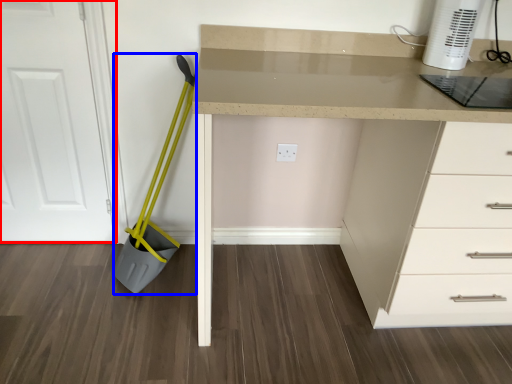
Question: Which object is further to the camera taking this photo, door (highlighted by a red box) or shovel (highlighted by a blue box)?

Choices:
 (A) door
 (B) shovel

Answer: (A)